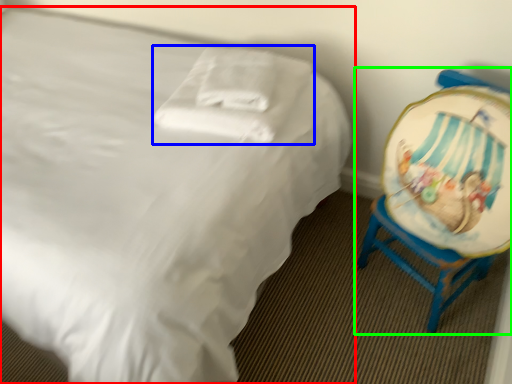
Question: Which is farther away from bed (highlighted by a red box)? pillow (highlighted by a blue box) or chair (highlighted by a green box)?

Choices:
 (A) pillow
 (B) chair

Answer: (B)